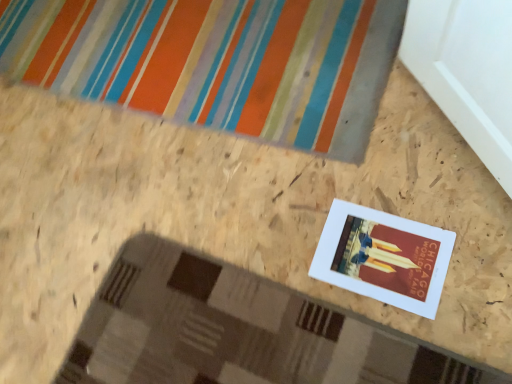
Question: From the image's perspective, is white matte picture frame at center above multicolored striped bath mat at upper center?

Choices:
 (A) yes
 (B) no

Answer: (B)

Question: Is white matte picture frame at center at the left side of multicolored striped bath mat at upper center?

Choices:
 (A) no
 (B) yes

Answer: (A)

Question: Considering the relative sizes of white matte picture frame at center and multicolored striped bath mat at upper center in the image provided, is white matte picture frame at center shorter than multicolored striped bath mat at upper center?

Choices:
 (A) yes
 (B) no

Answer: (A)

Question: Can you confirm if white matte picture frame at center is smaller than multicolored striped bath mat at upper center?

Choices:
 (A) no
 (B) yes

Answer: (B)

Question: From the image's perspective, does white matte picture frame at center appear lower than multicolored striped bath mat at upper center?

Choices:
 (A) yes
 (B) no

Answer: (A)

Question: Is white matte picture frame at center taller than multicolored striped bath mat at upper center?

Choices:
 (A) yes
 (B) no

Answer: (B)

Question: From a real-world perspective, is multicolored striped bath mat at upper center physically above white matte picture frame at center?

Choices:
 (A) yes
 (B) no

Answer: (A)

Question: Does multicolored striped bath mat at upper center come behind white matte picture frame at center?

Choices:
 (A) yes
 (B) no

Answer: (A)

Question: Considering the relative positions of multicolored striped bath mat at upper center and white matte picture frame at center in the image provided, is multicolored striped bath mat at upper center to the right of white matte picture frame at center from the viewer's perspective?

Choices:
 (A) yes
 (B) no

Answer: (B)

Question: Is multicolored striped bath mat at upper center not near white matte picture frame at center?

Choices:
 (A) no
 (B) yes

Answer: (A)

Question: From the image's perspective, would you say multicolored striped bath mat at upper center is positioned over white matte picture frame at center?

Choices:
 (A) yes
 (B) no

Answer: (A)

Question: Is multicolored striped bath mat at upper center at the left side of white matte picture frame at center?

Choices:
 (A) yes
 (B) no

Answer: (A)

Question: Considering the positions of white matte picture frame at center and multicolored striped bath mat at upper center in the image, is white matte picture frame at center taller or shorter than multicolored striped bath mat at upper center?

Choices:
 (A) short
 (B) tall

Answer: (A)